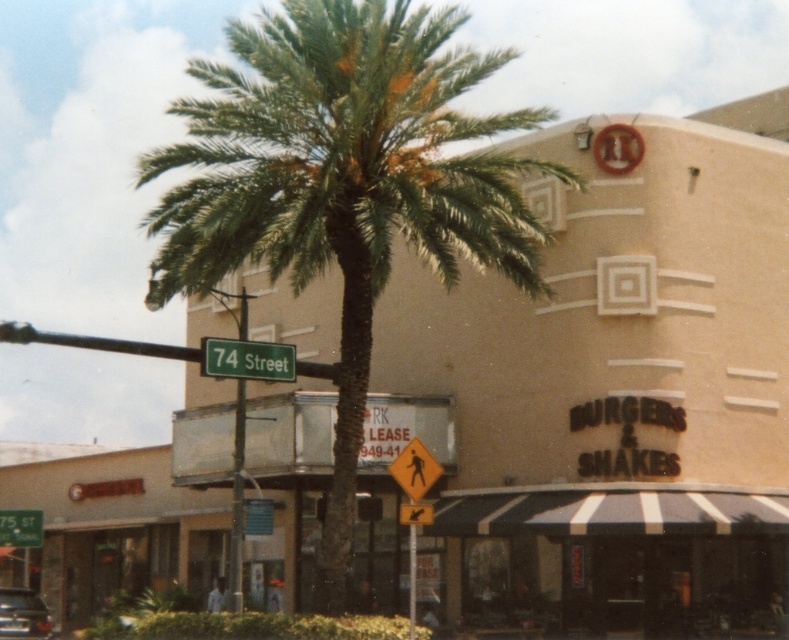
Question: Is green leafy palm tree at center positioned behind black striped awning at lower center?

Choices:
 (A) no
 (B) yes

Answer: (A)

Question: Can you confirm if black striped awning at lower center is thinner than green matte street sign at upper center?

Choices:
 (A) no
 (B) yes

Answer: (A)

Question: Which object is positioned closest to the green plastic street sign at lower left?

Choices:
 (A) green leafy palm tree at center
 (B) metallic silver car at lower left

Answer: (B)

Question: Does green leafy palm tree at center have a greater width compared to black striped awning at lower center?

Choices:
 (A) no
 (B) yes

Answer: (B)

Question: Which point is closer to the camera?

Choices:
 (A) metallic silver car at lower left
 (B) green leafy palm tree at center
 (C) black striped awning at lower center
 (D) green matte street sign at upper center

Answer: (B)

Question: Which point is farther to the camera?

Choices:
 (A) (234, 365)
 (B) (675, 525)

Answer: (B)